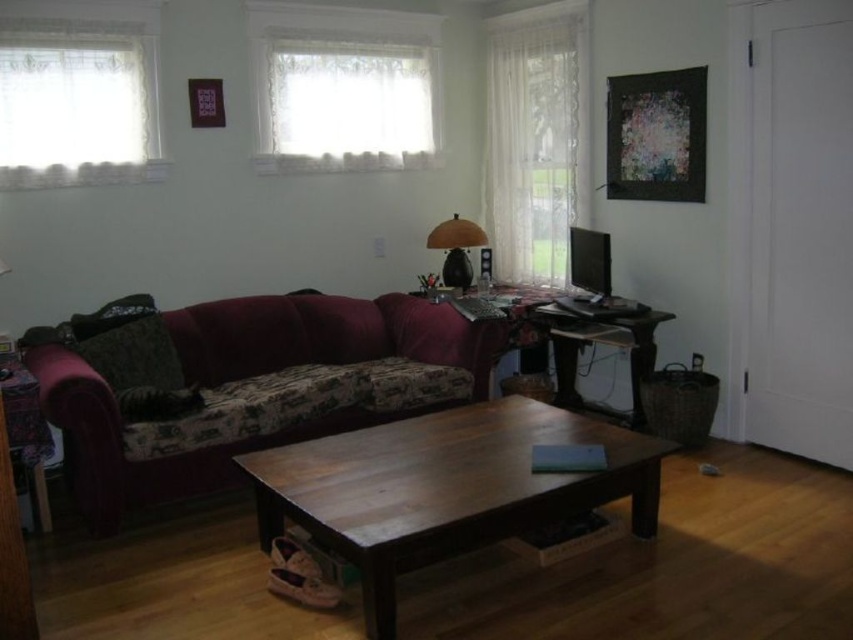
Which is above, wooden coffee table at center or velvet fabric couch at left?

Positioned higher is velvet fabric couch at left.

Who is more distant from viewer, (410, 442) or (64, 355)?

Positioned behind is point (64, 355).

Image resolution: width=853 pixels, height=640 pixels. I want to click on wooden coffee table at center, so click(x=444, y=486).

Can you confirm if white sheer curtain at upper center is positioned above white sheer curtain at upper left?

Yes.

Is point (361, 164) more distant than point (54, 144)?

That is True.

Where is `white sheer curtain at upper center`? The width and height of the screenshot is (853, 640). white sheer curtain at upper center is located at coordinates (346, 96).

Between velvet fabric couch at left and matte brown lamp at center, which one appears on the right side from the viewer's perspective?

Positioned to the right is matte brown lamp at center.

Describe the element at coordinates (326, 337) in the screenshot. I see `velvet fabric couch at left` at that location.

The width and height of the screenshot is (853, 640). What are the coordinates of `velvet fabric couch at left` in the screenshot? It's located at (x=326, y=337).